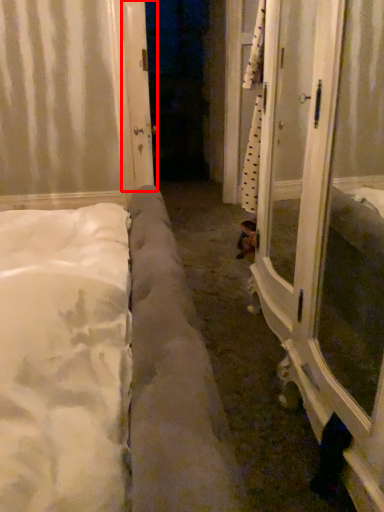
Question: Where is door (annotated by the red box) located in relation to screen door in the image?

Choices:
 (A) left
 (B) right

Answer: (A)